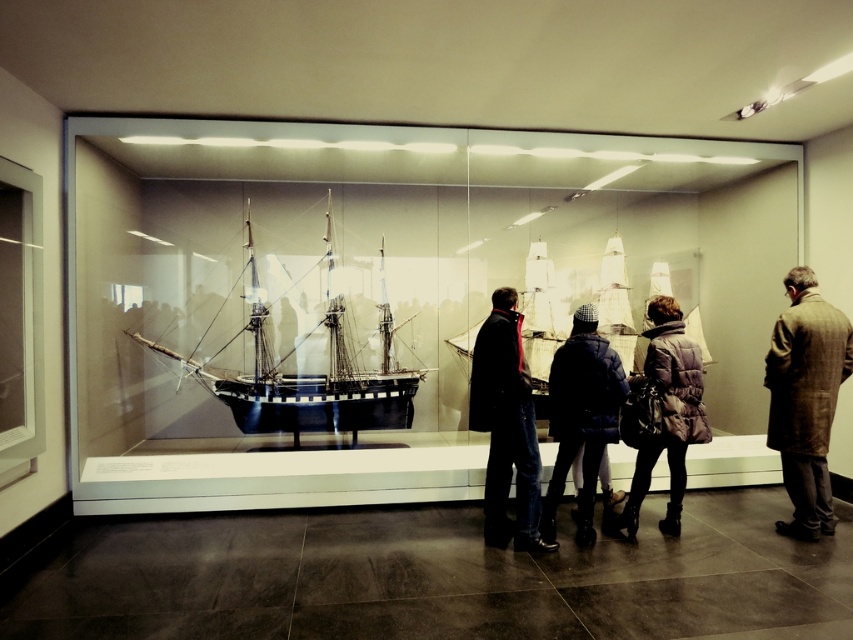
Question: Which point is farther to the camera?

Choices:
 (A) (527, 538)
 (B) (827, 339)
 (C) (590, 388)
 (D) (288, 390)

Answer: (D)

Question: Does black polished wood ship at center have a lesser width compared to dark blue quilted jacket at center?

Choices:
 (A) yes
 (B) no

Answer: (B)

Question: Estimate the real-world distances between objects in this image. Which object is closer to the dark blue quilted jacket at center?

Choices:
 (A) dark brown leather coat at center
 (B) purple down vest at center
 (C) black polished wood ship at center

Answer: (A)

Question: Is the position of brown wool coat at right less distant than that of purple down vest at center?

Choices:
 (A) no
 (B) yes

Answer: (A)

Question: Which point is closer to the camera taking this photo?

Choices:
 (A) pos(671,388)
 (B) pos(518,484)
 (C) pos(801,424)
 (D) pos(569,355)

Answer: (B)

Question: Does black polished wood ship at center appear over dark blue quilted jacket at center?

Choices:
 (A) yes
 (B) no

Answer: (A)